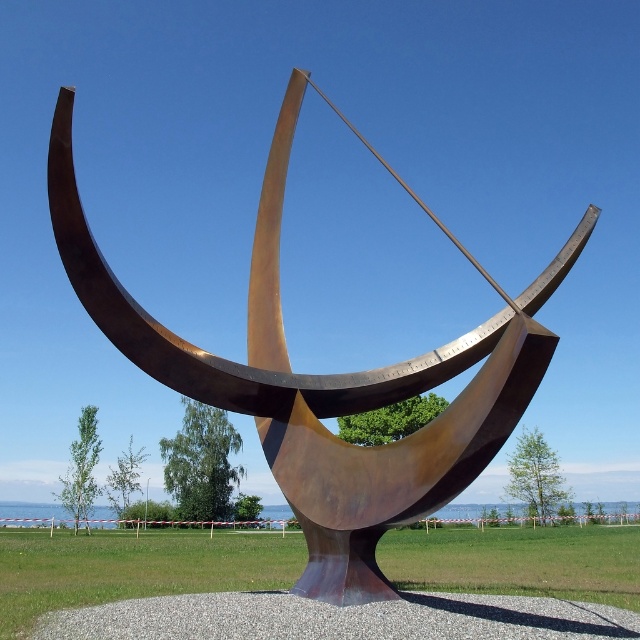
Describe the element at coordinates (324, 380) in the screenshot. I see `rusty metal sundial at center` at that location.

Which is in front, point (305, 88) or point (388, 616)?

Positioned in front is point (388, 616).

Locate an element on the screen. This screenshot has width=640, height=640. rusty metal sundial at center is located at coordinates (324, 380).